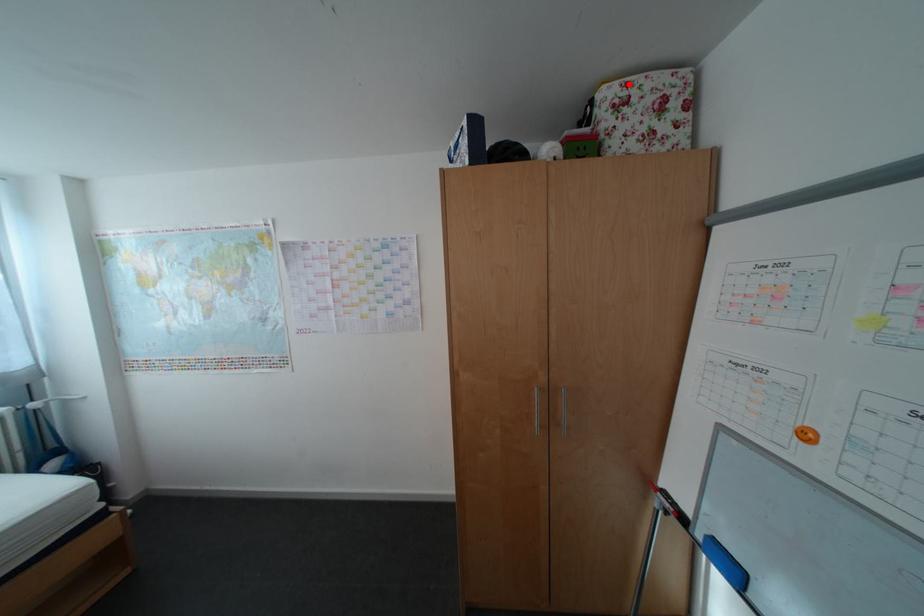
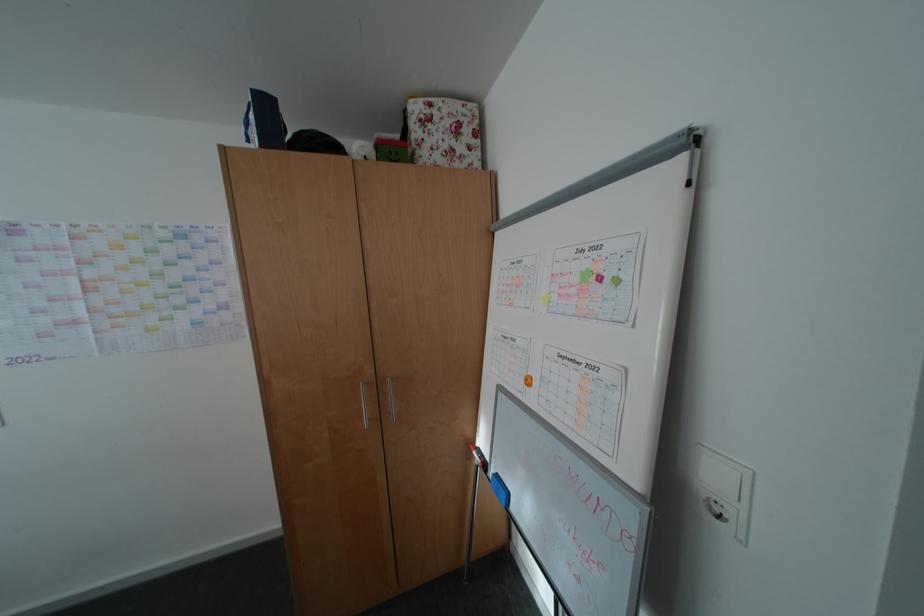
Where in the second image is the point corresponding to the highlighted location from the first image?

(433, 102)